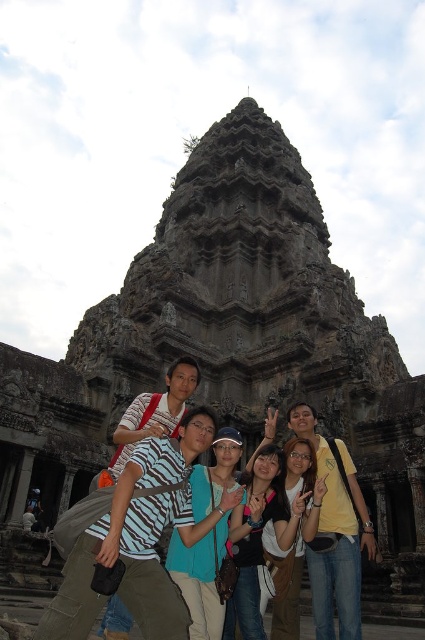
Question: Is zebra-patterned shirt at center further to camera compared to matte black shirt at center?

Choices:
 (A) yes
 (B) no

Answer: (B)

Question: Does zebra-patterned shirt at center have a lesser width compared to yellow cotton shirt at center?

Choices:
 (A) yes
 (B) no

Answer: (B)

Question: Which object is the farthest from the matte black shirt at center?

Choices:
 (A) zebra-patterned shirt at center
 (B) denim jacket at lower center
 (C) teal fabric shirt at center
 (D) yellow cotton shirt at center

Answer: (A)

Question: Can you confirm if teal fabric shirt at center is positioned above matte black shirt at center?

Choices:
 (A) yes
 (B) no

Answer: (A)

Question: Which point is closer to the camera?

Choices:
 (A) matte black shirt at center
 (B) teal fabric shirt at center
 (C) zebra-patterned shirt at center

Answer: (C)

Question: Which object appears farthest from the camera in this image?

Choices:
 (A) denim jacket at lower center
 (B) matte black shirt at center
 (C) teal fabric shirt at center
 (D) zebra-patterned shirt at center

Answer: (B)